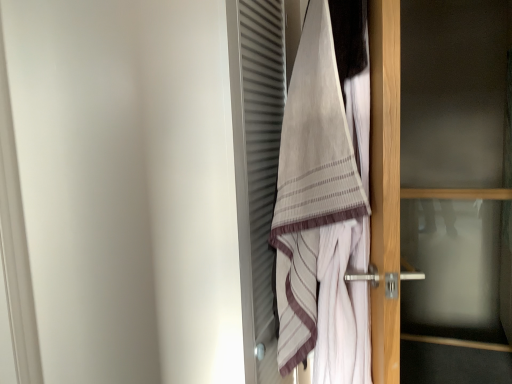
Identify the location of transparent glass door at right. (389, 185).

This screenshot has width=512, height=384. Describe the element at coordinates (389, 185) in the screenshot. I see `transparent glass door at right` at that location.

Image resolution: width=512 pixels, height=384 pixels. What are the coordinates of `beige striped towel at center` in the screenshot? It's located at (323, 202).

Describe the element at coordinates (323, 202) in the screenshot. I see `beige striped towel at center` at that location.

Identify the location of transparent glass door at right. (389, 185).

Which is more to the right, transparent glass door at right or beige striped towel at center?

transparent glass door at right.

Is transparent glass door at right in front of or behind beige striped towel at center in the image?

transparent glass door at right is positioned farther from the viewer than beige striped towel at center.

Is point (394, 143) closer to viewer compared to point (328, 224)?

Yes, it is in front of point (328, 224).

From the image's perspective, relative to beige striped towel at center, is transparent glass door at right above or below?

Based on their image positions, transparent glass door at right is located beneath beige striped towel at center.

From a real-world perspective, is transparent glass door at right positioned over beige striped towel at center based on gravity?

No, from a real-world perspective, transparent glass door at right is not on top of beige striped towel at center.

Can you confirm if transparent glass door at right is wider than beige striped towel at center?

No.

Considering the sizes of objects transparent glass door at right and beige striped towel at center in the image provided, who is shorter, transparent glass door at right or beige striped towel at center?

With less height is beige striped towel at center.

In terms of size, does transparent glass door at right appear bigger or smaller than beige striped towel at center?

In the image, transparent glass door at right appears to be larger than beige striped towel at center.

Would you say transparent glass door at right is inside or outside beige striped towel at center?

The correct answer is: outside.

Would you consider transparent glass door at right to be distant from beige striped towel at center?

No.

Is transparent glass door at right aimed at beige striped towel at center?

No.

In the image, there is a beige striped towel at center. Where is `door below it (from the image's perspective)`? This screenshot has width=512, height=384. door below it (from the image's perspective) is located at coordinates (389, 185).

Which object is positioned more to the left, beige striped towel at center or transparent glass door at right?

Positioned to the left is beige striped towel at center.

Is beige striped towel at center positioned in front of transparent glass door at right?

Yes.

Is point (326, 154) closer or farther from the camera than point (396, 212)?

Clearly, point (326, 154) is more distant from the camera than point (396, 212).

From the image's perspective, who appears lower, beige striped towel at center or transparent glass door at right?

transparent glass door at right appears lower in the image.

From a real-world perspective, which object rests below the other?

transparent glass door at right, from a real-world perspective.

Is beige striped towel at center thinner than transparent glass door at right?

No, beige striped towel at center is not thinner than transparent glass door at right.

From their relative heights in the image, would you say beige striped towel at center is taller or shorter than transparent glass door at right?

Considering their sizes, beige striped towel at center has less height than transparent glass door at right.

Can you confirm if beige striped towel at center is bigger than transparent glass door at right?

No.

Choose the correct answer: Is beige striped towel at center inside transparent glass door at right or outside it?

beige striped towel at center is spatially situated outside transparent glass door at right.

Are beige striped towel at center and transparent glass door at right making contact?

beige striped towel at center and transparent glass door at right are not in contact.

Is beige striped towel at center facing towards transparent glass door at right?

No.

Locate an element on the screen. This screenshot has height=384, width=512. towel that is above the transparent glass door at right (from a real-world perspective) is located at coordinates (323, 202).

Where is `door on the right side of beige striped towel at center`? The height and width of the screenshot is (384, 512). door on the right side of beige striped towel at center is located at coordinates (389, 185).

This screenshot has width=512, height=384. In order to click on door behind the beige striped towel at center in this screenshot , I will do `click(389, 185)`.